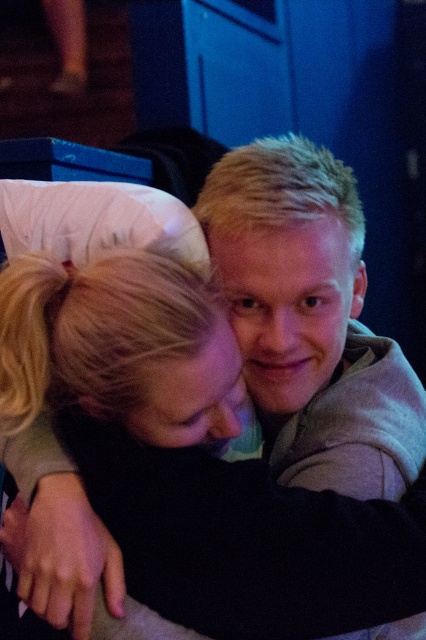
Can you confirm if gray fleece hoodie at center is wider than black soft fabric at center?

Correct, the width of gray fleece hoodie at center exceeds that of black soft fabric at center.

Is point (339, 241) in front of point (97, 298)?

No, it is behind (97, 298).

The height and width of the screenshot is (640, 426). I want to click on gray fleece hoodie at center, so click(x=310, y=321).